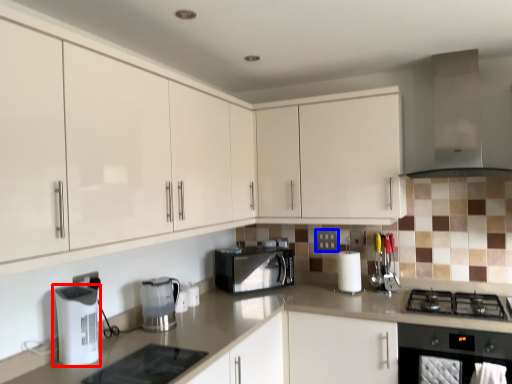
Question: Which of the following is the farthest to the observer, kitchen appliance (highlighted by a red box) or electric outlet (highlighted by a blue box)?

Choices:
 (A) kitchen appliance
 (B) electric outlet

Answer: (B)